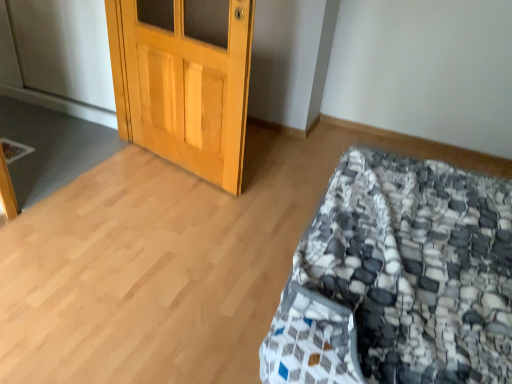
The image size is (512, 384). What do you see at coordinates (398, 279) in the screenshot?
I see `textured gray and white quilt at lower right` at bounding box center [398, 279].

Where is `textured gray and white quilt at lower right`? textured gray and white quilt at lower right is located at coordinates (398, 279).

The image size is (512, 384). What do you see at coordinates (184, 81) in the screenshot? I see `wooden door at upper left` at bounding box center [184, 81].

In order to click on wooden door at upper left in this screenshot , I will do `click(184, 81)`.

You are a GUI agent. You are given a task and a screenshot of the screen. Output one action in this format:
    pyautogui.click(x=<x>, y=<y>)
    Task: Click on the textured gray and white quilt at lower right
    Image resolution: width=512 pixels, height=384 pixels.
    Given the screenshot: What is the action you would take?
    point(398,279)

Considering the relative positions of textured gray and white quilt at lower right and wooden door at upper left in the image provided, is textured gray and white quilt at lower right to the left of wooden door at upper left from the viewer's perspective?

Incorrect, textured gray and white quilt at lower right is not on the left side of wooden door at upper left.

Considering the positions of objects textured gray and white quilt at lower right and wooden door at upper left in the image provided, who is behind, textured gray and white quilt at lower right or wooden door at upper left?

Positioned behind is wooden door at upper left.

Considering the positions of points (423, 366) and (243, 146), is point (423, 366) closer to camera compared to point (243, 146)?

Yes, it is in front of point (243, 146).

From the image's perspective, between textured gray and white quilt at lower right and wooden door at upper left, which one is located above?

From the image's view, wooden door at upper left is above.

From a real-world perspective, who is located higher, textured gray and white quilt at lower right or wooden door at upper left?

wooden door at upper left is physically above.

Which of these two, textured gray and white quilt at lower right or wooden door at upper left, is thinner?

wooden door at upper left is thinner.

Considering the sizes of textured gray and white quilt at lower right and wooden door at upper left in the image, is textured gray and white quilt at lower right taller or shorter than wooden door at upper left?

textured gray and white quilt at lower right is shorter than wooden door at upper left.

Looking at the image, does textured gray and white quilt at lower right seem bigger or smaller compared to wooden door at upper left?

Clearly, textured gray and white quilt at lower right is larger in size than wooden door at upper left.

Is textured gray and white quilt at lower right situated inside wooden door at upper left or outside?

textured gray and white quilt at lower right cannot be found inside wooden door at upper left.

Can you see textured gray and white quilt at lower right touching wooden door at upper left?

No, textured gray and white quilt at lower right is not making contact with wooden door at upper left.

From the picture: Is textured gray and white quilt at lower right facing towards wooden door at upper left?

Yes, textured gray and white quilt at lower right is turned towards wooden door at upper left.

How many degrees apart are the facing directions of textured gray and white quilt at lower right and wooden door at upper left?

textured gray and white quilt at lower right and wooden door at upper left are facing 75.8 degrees away from each other.

How much distance is there between textured gray and white quilt at lower right and wooden door at upper left?

textured gray and white quilt at lower right and wooden door at upper left are 3.43 feet apart from each other.

Where is `door that is behind the textured gray and white quilt at lower right`? The height and width of the screenshot is (384, 512). door that is behind the textured gray and white quilt at lower right is located at coordinates (184, 81).

Considering the positions of objects wooden door at upper left and textured gray and white quilt at lower right in the image provided, who is more to the right, wooden door at upper left or textured gray and white quilt at lower right?

textured gray and white quilt at lower right is more to the right.

Which object is closer to the camera, wooden door at upper left or textured gray and white quilt at lower right?

textured gray and white quilt at lower right.

Between point (234, 50) and point (364, 213), which one is positioned in front?

The point (364, 213) is closer to the camera.

From the image's perspective, would you say wooden door at upper left is shown under textured gray and white quilt at lower right?

Incorrect, from the image's perspective, wooden door at upper left is higher than textured gray and white quilt at lower right.

In the scene shown: From a real-world perspective, is wooden door at upper left on textured gray and white quilt at lower right?

Yes, from a real-world perspective, wooden door at upper left is above textured gray and white quilt at lower right.

Which of these two, wooden door at upper left or textured gray and white quilt at lower right, is thinner?

Thinner between the two is wooden door at upper left.

Considering the sizes of objects wooden door at upper left and textured gray and white quilt at lower right in the image provided, who is shorter, wooden door at upper left or textured gray and white quilt at lower right?

textured gray and white quilt at lower right is shorter.

Between wooden door at upper left and textured gray and white quilt at lower right, which one has larger size?

textured gray and white quilt at lower right is bigger.

Would you say wooden door at upper left is inside or outside textured gray and white quilt at lower right?

wooden door at upper left is outside textured gray and white quilt at lower right.

Are wooden door at upper left and textured gray and white quilt at lower right located far from each other?

Indeed, wooden door at upper left is not near textured gray and white quilt at lower right.

Does wooden door at upper left turn towards textured gray and white quilt at lower right?

No, wooden door at upper left is not turned towards textured gray and white quilt at lower right.

Can you tell me how much wooden door at upper left and textured gray and white quilt at lower right differ in facing direction?

wooden door at upper left and textured gray and white quilt at lower right are facing 75.8 degrees away from each other.

How distant is wooden door at upper left from textured gray and white quilt at lower right?

wooden door at upper left is 3.43 feet from textured gray and white quilt at lower right.

The width and height of the screenshot is (512, 384). Find the location of `bed that is below the wooden door at upper left (from the image's perspective)`. bed that is below the wooden door at upper left (from the image's perspective) is located at coordinates (398, 279).

Locate an element on the screen. The width and height of the screenshot is (512, 384). bed on the right of wooden door at upper left is located at coordinates (398, 279).

This screenshot has width=512, height=384. Identify the location of door above the textured gray and white quilt at lower right (from the image's perspective). (184, 81).